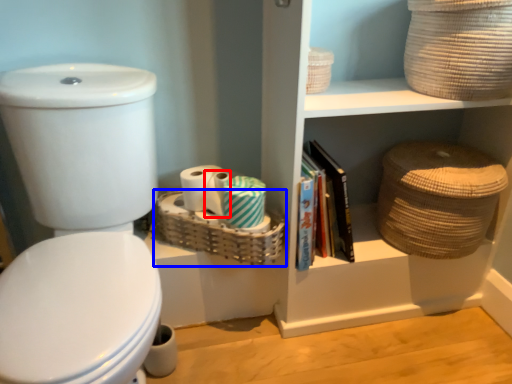
Question: Which object is closer to the camera taking this photo, toilet paper (highlighted by a red box) or basket (highlighted by a blue box)?

Choices:
 (A) toilet paper
 (B) basket

Answer: (B)